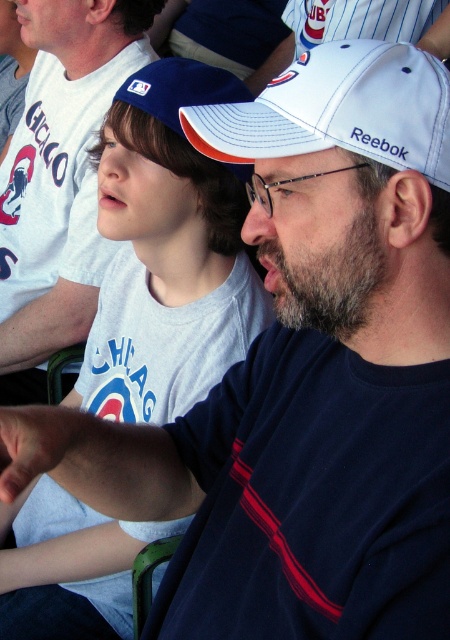
You are a photographer at the sports event. You need to capture a photo that includes both the white cotton shirt at upper left and the white matte baseball cap at center. Based on their positions, which object should be placed on the left side of the photo frame to ensure both are visible?

The white cotton shirt at upper left should be placed on the left side of the photo frame because it is to the left of the white matte baseball cap at center, ensuring both are visible in the frame.

You are a photographer at the sports event and need to capture a photo of both the white cotton shirt at upper left and the white matte baseball cap at upper center. Based on their positions, which object should you focus on first to ensure both are in frame?

The white cotton shirt at upper left is to the right of the white matte baseball cap at upper center, so you should focus on the white matte baseball cap at upper center first to ensure both are in frame.